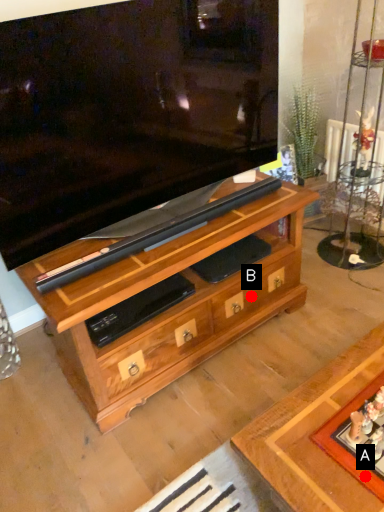
Question: Two points are circled on the image, labeled by A and B beside each circle. Which of the following is the closest to the observer?

Choices:
 (A) A is closer
 (B) B is closer

Answer: (A)